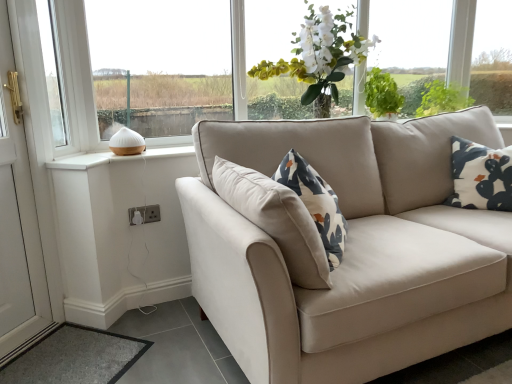
What do you see at coordinates (443, 98) in the screenshot? I see `green leafy plant at upper right` at bounding box center [443, 98].

Describe the element at coordinates (320, 56) in the screenshot. The height and width of the screenshot is (384, 512). I see `white silk flowers at upper center` at that location.

Where is `white plastic socket at lower left`? The image size is (512, 384). white plastic socket at lower left is located at coordinates (144, 214).

What do you see at coordinates (52, 72) in the screenshot? I see `white plastic window at upper left, which is the first window in left-to-right order` at bounding box center [52, 72].

This screenshot has width=512, height=384. What are the coordinates of `white glossy door at left` in the screenshot? It's located at (26, 189).

Would you say gray carpet at lower left is outside white ceramic diffuser at left, the second window positioned from the left?

Yes, gray carpet at lower left is located beyond the bounds of white ceramic diffuser at left, the second window positioned from the left.

Are gray carpet at lower left and white ceramic diffuser at left, acting as the 1th window starting from the right, located far from each other?

That's right, there is a large distance between gray carpet at lower left and white ceramic diffuser at left, acting as the 1th window starting from the right.

From the image's perspective, is gray carpet at lower left on top of white ceramic diffuser at left, acting as the 1th window starting from the right?

No.

Can you tell me how much gray carpet at lower left and white ceramic diffuser at left, acting as the 1th window starting from the right, differ in facing direction?

43.9 degrees.

In the image, is white cotton pillow at upper right on the left side or the right side of white silk flowers at upper center?

white cotton pillow at upper right is positioned on white silk flowers at upper center's right side.

Is point (480, 199) positioned behind point (364, 68)?

No, (480, 199) is closer to viewer.

Is white cotton pillow at upper right in contact with white silk flowers at upper center?

No, white cotton pillow at upper right is not with white silk flowers at upper center.

From the image's perspective, would you say gray carpet at lower left is positioned over white cotton pillow at upper right?

No, from the image's perspective, gray carpet at lower left is not on top of white cotton pillow at upper right.

Is gray carpet at lower left positioned beyond the bounds of white cotton pillow at upper right?

Absolutely, gray carpet at lower left is external to white cotton pillow at upper right.

Considering the sizes of white plastic socket at lower left and white cotton pillow at upper right in the image, is white plastic socket at lower left wider or thinner than white cotton pillow at upper right?

Clearly, white plastic socket at lower left has less width compared to white cotton pillow at upper right.

Considering the relative positions of white plastic socket at lower left and white cotton pillow at upper right in the image provided, is white plastic socket at lower left to the left of white cotton pillow at upper right from the viewer's perspective?

Yes.

From the image's perspective, which one is positioned higher, white plastic socket at lower left or white cotton pillow at upper right?

white cotton pillow at upper right.

Which is in front, white plastic socket at lower left or white cotton pillow at upper right?

white cotton pillow at upper right.

Consider the image. Is white cotton pillow at upper right closer to camera compared to white glossy door at left?

No, white cotton pillow at upper right is behind white glossy door at left.

Considering the sizes of objects white cotton pillow at upper right and white glossy door at left in the image provided, who is taller, white cotton pillow at upper right or white glossy door at left?

white glossy door at left.

Which is less distant, (483, 172) or (25, 81)?

Point (483, 172) appears to be farther away from the viewer than point (25, 81).

Is white cotton pillow at upper right looking in the opposite direction of white glossy door at left?

No, white cotton pillow at upper right is not facing the opposite direction of white glossy door at left.

From the image's perspective, is white plastic socket at lower left beneath white plastic window at upper left, which is the first window in left-to-right order?

Yes, from the image's perspective, white plastic socket at lower left is below white plastic window at upper left, which is the first window in left-to-right order.

Does white plastic socket at lower left come behind white plastic window at upper left, which is the first window in left-to-right order?

Yes, it is behind white plastic window at upper left, which is the first window in left-to-right order.

Considering the relative sizes of white plastic socket at lower left and white plastic window at upper left, arranged as the second window when viewed from the right, in the image provided, is white plastic socket at lower left thinner than white plastic window at upper left, arranged as the second window when viewed from the right,?

Correct, the width of white plastic socket at lower left is less than that of white plastic window at upper left, arranged as the second window when viewed from the right.

From a real-world perspective, between white plastic window at upper left, arranged as the second window when viewed from the right, and white silk flowers at upper center, who is vertically higher?

white silk flowers at upper center, from a real-world perspective.

Is white plastic window at upper left, arranged as the second window when viewed from the right, to the left of white silk flowers at upper center from the viewer's perspective?

Yes, white plastic window at upper left, arranged as the second window when viewed from the right, is to the left of white silk flowers at upper center.

Considering the relative sizes of white plastic window at upper left, which is the first window in left-to-right order, and white silk flowers at upper center in the image provided, is white plastic window at upper left, which is the first window in left-to-right order, bigger than white silk flowers at upper center?

No.

Locate an element on the screen. window that is the 2nd one above the gray carpet at lower left (from a real-world perspective) is located at coordinates (160, 64).

Identify the location of floral arrangement located behind the white cotton pillow at upper right. (320, 56).

Which object lies nearer to the anchor point white plastic window at upper left, arranged as the second window when viewed from the right, white ceramic diffuser at left, the second window positioned from the left, or white plastic socket at lower left?

Based on the image, white ceramic diffuser at left, the second window positioned from the left, appears to be nearer to white plastic window at upper left, arranged as the second window when viewed from the right.

When comparing their distances from white plastic window at upper left, arranged as the second window when viewed from the right, does gray carpet at lower left or green leafy plant at upper right seem closer?

Based on the image, gray carpet at lower left appears to be nearer to white plastic window at upper left, arranged as the second window when viewed from the right.

Estimate the real-world distances between objects in this image. Which object is further from white silk flowers at upper center, green leafy plant at upper right or white ceramic diffuser at left, acting as the 1th window starting from the right?

The object further to white silk flowers at upper center is green leafy plant at upper right.

Based on the photo, based on their spatial positions, is gray carpet at lower left or white ceramic diffuser at left, the second window positioned from the left, closer to white glossy door at left?

gray carpet at lower left lies closer to white glossy door at left than the other object.

Based on their spatial positions, is white plastic socket at lower left or green leafy plant at upper right further from white silk flowers at upper center?

white plastic socket at lower left is further to white silk flowers at upper center.

Looking at the image, which one is located closer to green leafy plant at upper right, white silk flowers at upper center or white plastic window at upper left, arranged as the second window when viewed from the right?

white silk flowers at upper center is positioned closer to the anchor green leafy plant at upper right.

Based on their spatial positions, is white plastic window at upper left, arranged as the second window when viewed from the right, or white silk flowers at upper center closer to white cotton pillow at upper right?

white silk flowers at upper center is positioned closer to the anchor white cotton pillow at upper right.

Considering their positions, is green leafy plant at upper right positioned closer to white plastic socket at lower left than white silk flowers at upper center?

The object closer to white plastic socket at lower left is white silk flowers at upper center.

Find the location of a particular element. The width and height of the screenshot is (512, 384). electric outlet between white plastic window at upper left, which is the first window in left-to-right order, and white silk flowers at upper center, in the horizontal direction is located at coordinates (144, 214).

Identify the location of floral arrangement located between white plastic socket at lower left and green leafy plant at upper right in the left-right direction. (320, 56).

The height and width of the screenshot is (384, 512). In order to click on mat between white plastic window at upper left, arranged as the second window when viewed from the right, and green leafy plant at upper right, in the horizontal direction in this screenshot , I will do `click(75, 357)`.

Where is `electric outlet that lies between white plastic window at upper left, which is the first window in left-to-right order, and gray carpet at lower left from top to bottom`? Image resolution: width=512 pixels, height=384 pixels. electric outlet that lies between white plastic window at upper left, which is the first window in left-to-right order, and gray carpet at lower left from top to bottom is located at coordinates (144, 214).